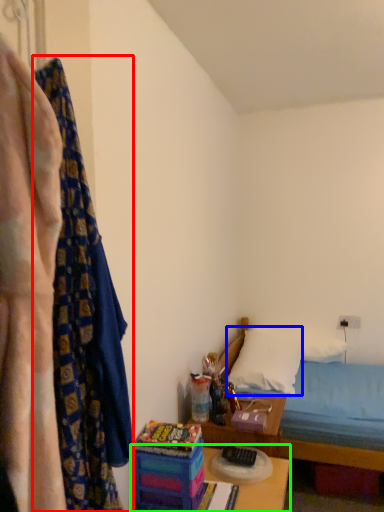
Question: Which object is positioned closest to curtain (highlighted by a red box)? Select from pillow (highlighted by a blue box) and table (highlighted by a green box).

Choices:
 (A) pillow
 (B) table

Answer: (B)